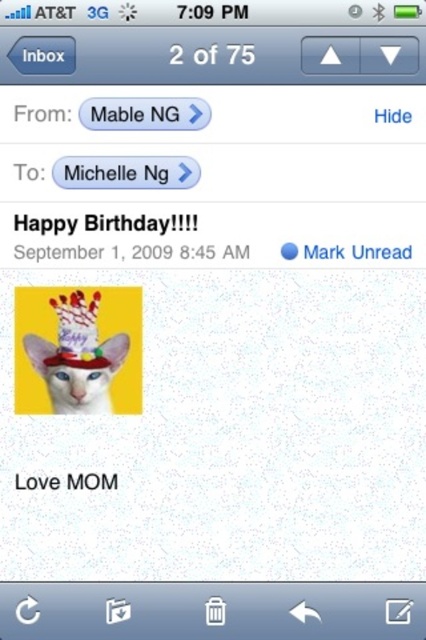
Which is more to the left, white matte cat at center or white paper text at upper center?

white matte cat at center

Can you confirm if white matte cat at center is smaller than white paper text at upper center?

Yes.

Find the location of a particular element. white matte cat at center is located at coordinates (75, 353).